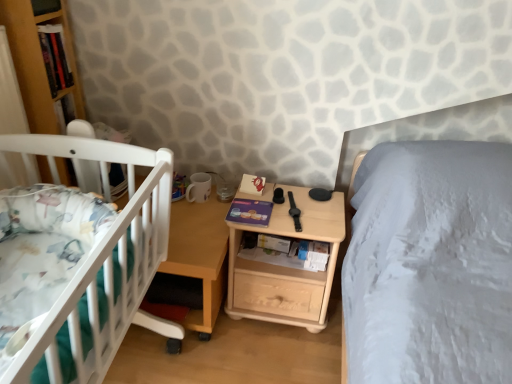
Question: From the image's perspective, is matte purple book at center, the 1th book in the bottom-to-top sequence, under hardcover book at upper left, the first book positioned from the top?

Choices:
 (A) yes
 (B) no

Answer: (A)

Question: Is the position of matte purple book at center, the 1th book in the bottom-to-top sequence, less distant than that of hardcover book at upper left, acting as the second book starting from the right?

Choices:
 (A) yes
 (B) no

Answer: (B)

Question: Is matte purple book at center, which is the first book from right to left, oriented away from hardcover book at upper left, acting as the second book starting from the right?

Choices:
 (A) yes
 (B) no

Answer: (B)

Question: Is matte purple book at center, which is the first book from right to left, directly adjacent to hardcover book at upper left, the second book from the bottom?

Choices:
 (A) no
 (B) yes

Answer: (A)

Question: Can you confirm if matte purple book at center, arranged as the second book when viewed from the top, is smaller than hardcover book at upper left, acting as the second book starting from the right?

Choices:
 (A) no
 (B) yes

Answer: (B)

Question: In terms of width, does white plastic crib at left look wider or thinner when compared to natural wood nightstand at center?

Choices:
 (A) thin
 (B) wide

Answer: (B)

Question: From the image's perspective, relative to natural wood nightstand at center, is white plastic crib at left above or below?

Choices:
 (A) below
 (B) above

Answer: (B)

Question: From a real-world perspective, relative to natural wood nightstand at center, is white plastic crib at left vertically above or below?

Choices:
 (A) above
 (B) below

Answer: (A)

Question: Choose the correct answer: Is white plastic crib at left inside natural wood nightstand at center or outside it?

Choices:
 (A) outside
 (B) inside

Answer: (A)

Question: Is matte purple book at center, which is the first book from right to left, situated inside natural wood nightstand at center or outside?

Choices:
 (A) outside
 (B) inside

Answer: (B)

Question: Considering the positions of point 270,211 and point 316,291, is point 270,211 closer or farther from the camera than point 316,291?

Choices:
 (A) farther
 (B) closer

Answer: (B)

Question: In terms of size, does matte purple book at center, arranged as the second book when viewed from the top, appear bigger or smaller than natural wood nightstand at center?

Choices:
 (A) small
 (B) big

Answer: (A)

Question: Is matte purple book at center, arranged as the second book when viewed from the top, wider or thinner than natural wood nightstand at center?

Choices:
 (A) thin
 (B) wide

Answer: (A)

Question: From the image's perspective, is white plastic crib at left located above or below matte purple book at center, which appears as the second book when viewed from the left?

Choices:
 (A) above
 (B) below

Answer: (B)

Question: From a real-world perspective, is white plastic crib at left positioned above or below matte purple book at center, which is the first book from right to left?

Choices:
 (A) above
 (B) below

Answer: (A)